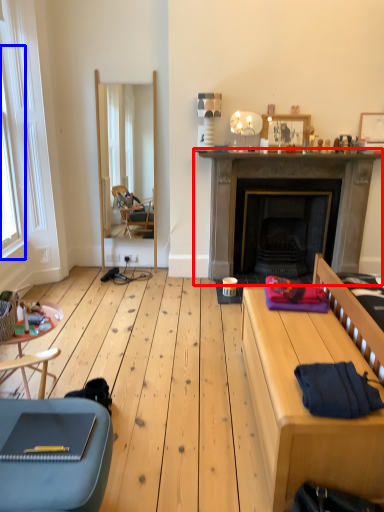
Question: Which object is closer to the camera taking this photo, fireplace (highlighted by a red box) or window (highlighted by a blue box)?

Choices:
 (A) fireplace
 (B) window

Answer: (B)